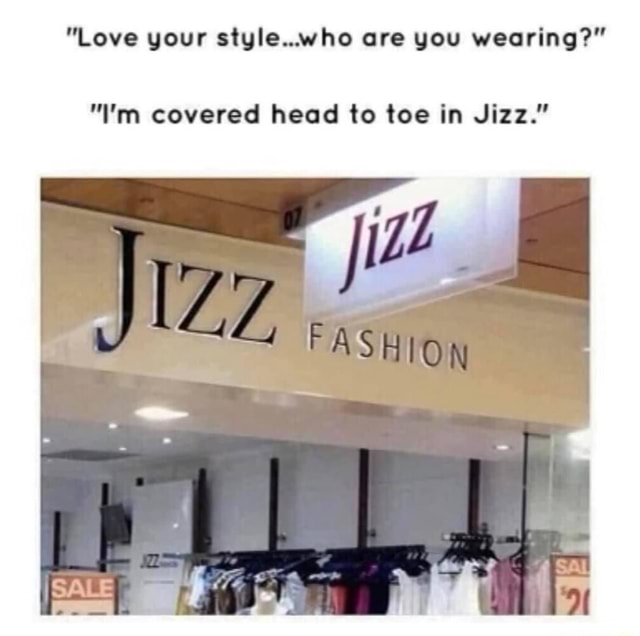
Where is `clothes rack`? Image resolution: width=640 pixels, height=636 pixels. clothes rack is located at coordinates (17, 448), (244, 556), (374, 551), (474, 537), (539, 536), (196, 556).